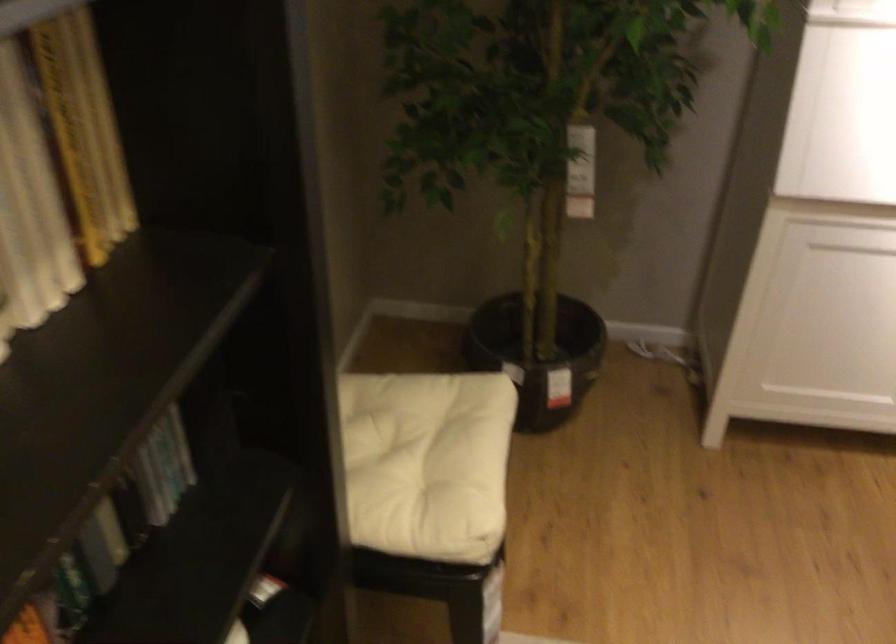
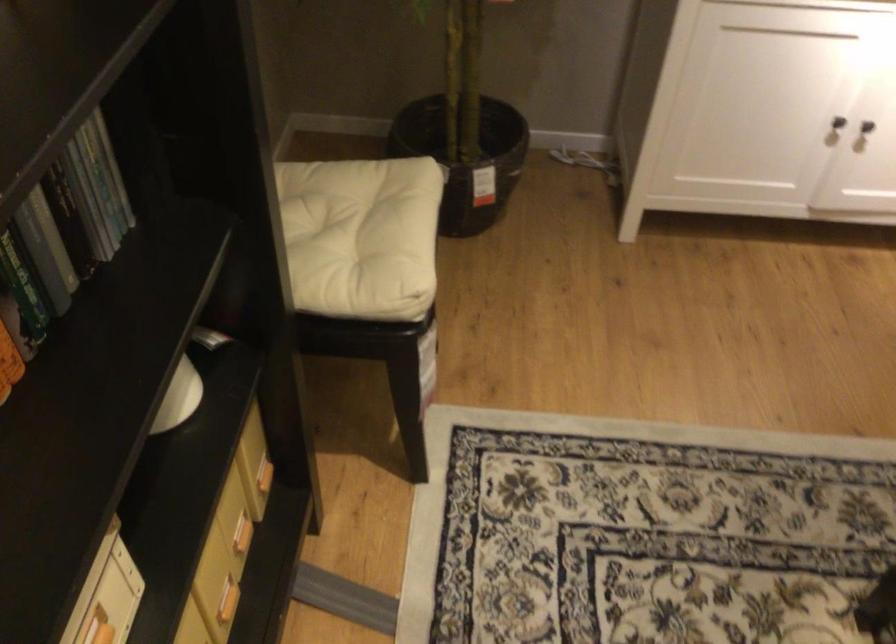
Where in the second image is the point corresponding to (76,516) from the first image?

(30, 240)